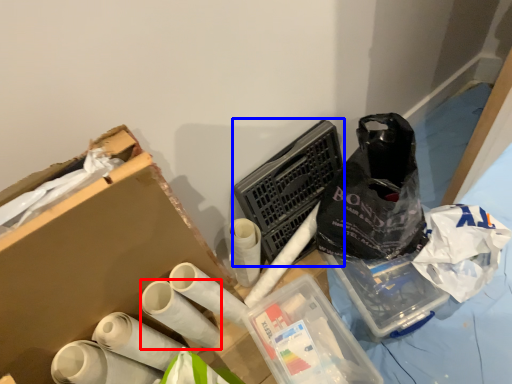
Question: Which object appears closest to the camera in this image, toilet paper (highlighted by a red box) or laundry basket (highlighted by a blue box)?

Choices:
 (A) toilet paper
 (B) laundry basket

Answer: (A)